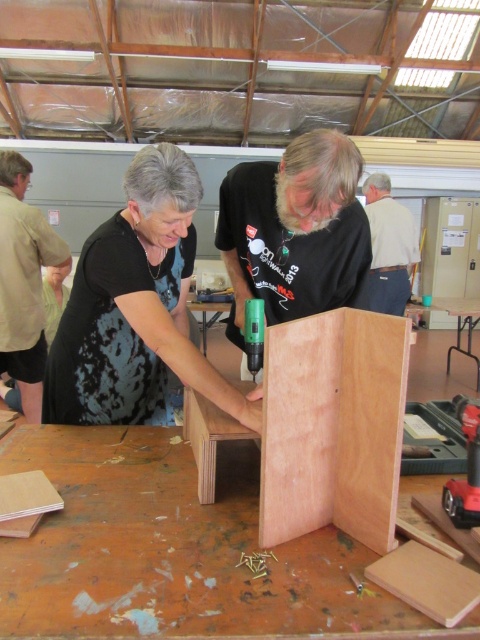
Between point (347, 636) and point (335, 140), which one is positioned in front?

Point (347, 636) is in front.

Looking at this image, can you confirm if plywood table at center is taller than matte black drill at center?

No.

Which is behind, point (41, 572) or point (300, 214)?

The point (300, 214) is more distant.

At what (x,y) coordinates should I click in order to perform the action: click on plywood table at center. Please return your answer as a coordinate pair (x, y). Looking at the image, I should click on (178, 552).

How distant is plywood table at center from plywoodwooden/plaincabinet/structure at center?

10.76 inches

Is plywood table at center smaller than plywoodwooden/plaincabinet/structure at center?

Actually, plywood table at center might be larger than plywoodwooden/plaincabinet/structure at center.

Who is more distant from viewer, [79,632] or [383,333]?

Point [383,333]

This screenshot has width=480, height=640. In order to click on plywood table at center in this screenshot , I will do `click(178, 552)`.

Who is more distant from viewer, [36,381] or [455,404]?

Positioned behind is point [36,381].

Does point (25, 161) come in front of point (453, 481)?

That is False.

What do you see at coordinates (24, 282) in the screenshot?
I see `brown leather shirt at upper center` at bounding box center [24, 282].

I want to click on brown leather shirt at upper center, so click(x=24, y=282).